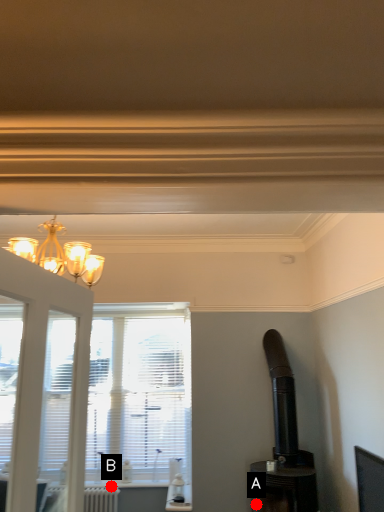
Question: Two points are circled on the image, labeled by A and B beside each circle. Which point appears farthest from the camera in this image?

Choices:
 (A) A is further
 (B) B is further

Answer: (B)